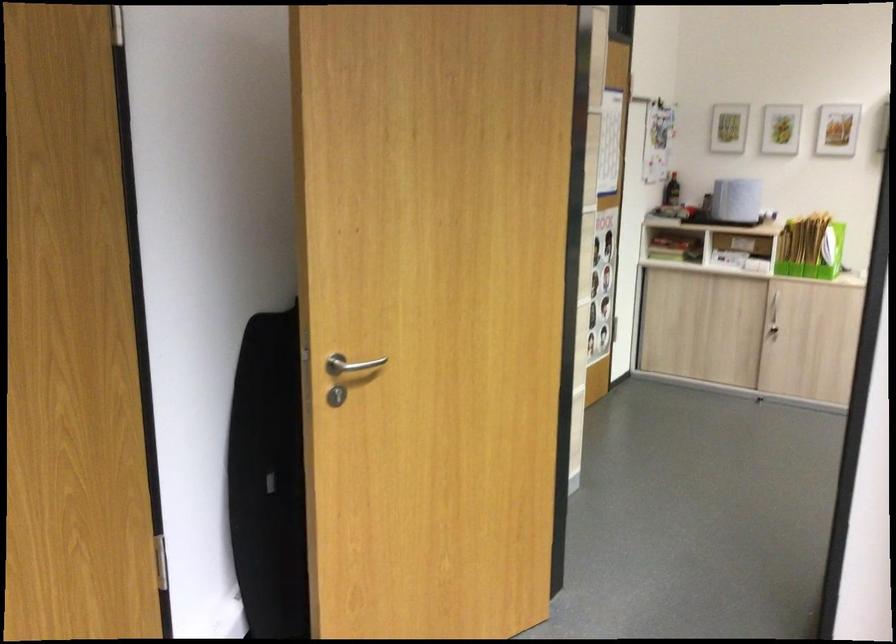
What do you see at coordinates (350, 365) in the screenshot? This screenshot has height=644, width=896. I see `a silver door handle` at bounding box center [350, 365].